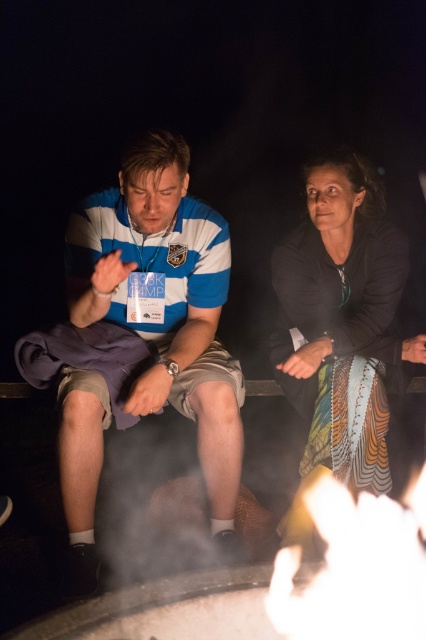
From the picture: You are standing in front of the campfire scene. You need to place a small flashlight between the striped polo shirt at left and the black matte dress at center. Where should you place it so it is equidistant from both?

The striped polo shirt at left is to the left of black matte dress at center, so placing the flashlight exactly halfway between them would ensure it is equidistant from both objects.

You are a photographer setting up a camera to take a portrait of both the striped polo shirt at left and the black matte dress at center. The camera has a minimum focusing distance of 50 centimeters. Will you need to adjust your position to ensure both subjects are in focus?

The striped polo shirt at left and black matte dress at center are 48.89 centimeters apart from each other, which is less than the camera minimum focusing distance of 50 centimeters. Therefore, you will need to move closer to ensure both subjects are in focus.

You are standing in front of the campfire scene. There are two points marked in the image. Which point, point (78,440) or point (371,257), is closer to you?

Point (78,440) is closer to the viewer than point (371,257).